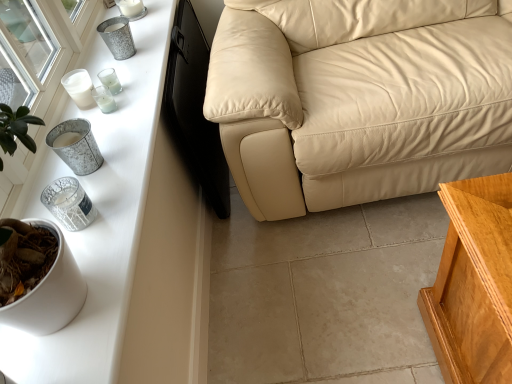
Where is `vacant space behind metallic glass candle at upper left, which appears as the 3th candle holder when ordered from the bottom`? vacant space behind metallic glass candle at upper left, which appears as the 3th candle holder when ordered from the bottom is located at coordinates (126, 80).